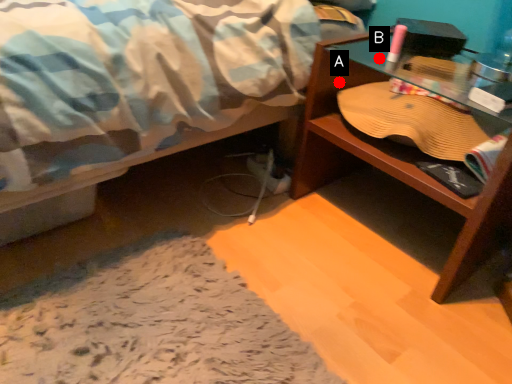
Question: Two points are circled on the image, labeled by A and B beside each circle. Which point appears closest to the camera in this image?

Choices:
 (A) A is closer
 (B) B is closer

Answer: (A)